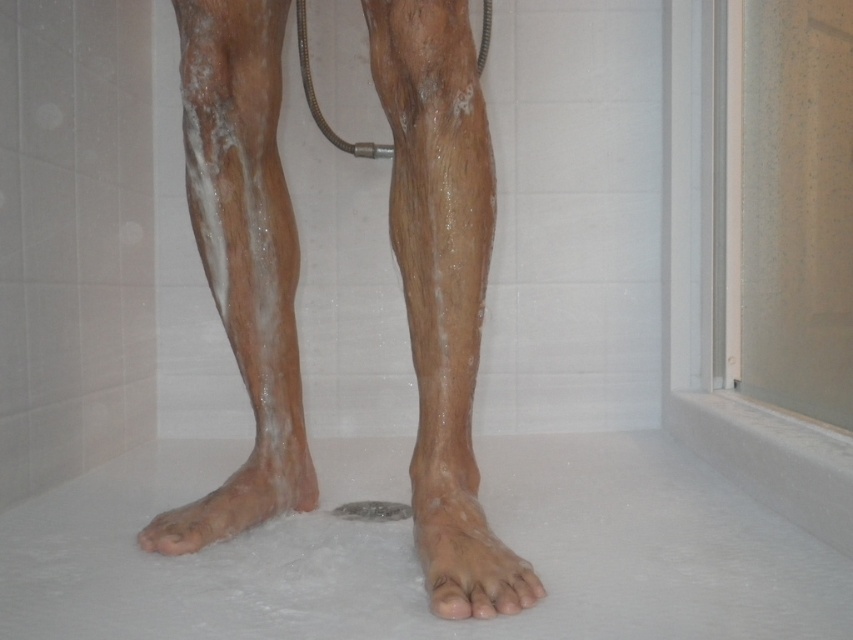
Question: Which object appears closest to the camera in this image?

Choices:
 (A) slightly wet skin foot at lower center
 (B) dry skin foot at lower center

Answer: (A)

Question: Which point is farther to the camera?

Choices:
 (A) click(x=300, y=460)
 (B) click(x=467, y=513)

Answer: (A)

Question: Can you confirm if slightly wet skin foot at lower center is positioned to the left of dry skin foot at lower center?

Choices:
 (A) no
 (B) yes

Answer: (A)

Question: Can you confirm if slightly wet skin foot at lower center is smaller than dry skin foot at lower center?

Choices:
 (A) no
 (B) yes

Answer: (B)

Question: Observing the image, what is the correct spatial positioning of slightly wet skin foot at lower center in reference to dry skin foot at lower center?

Choices:
 (A) below
 (B) above

Answer: (A)

Question: Among these objects, which one is nearest to the camera?

Choices:
 (A) dry skin foot at lower center
 (B) slightly wet skin foot at lower center

Answer: (B)